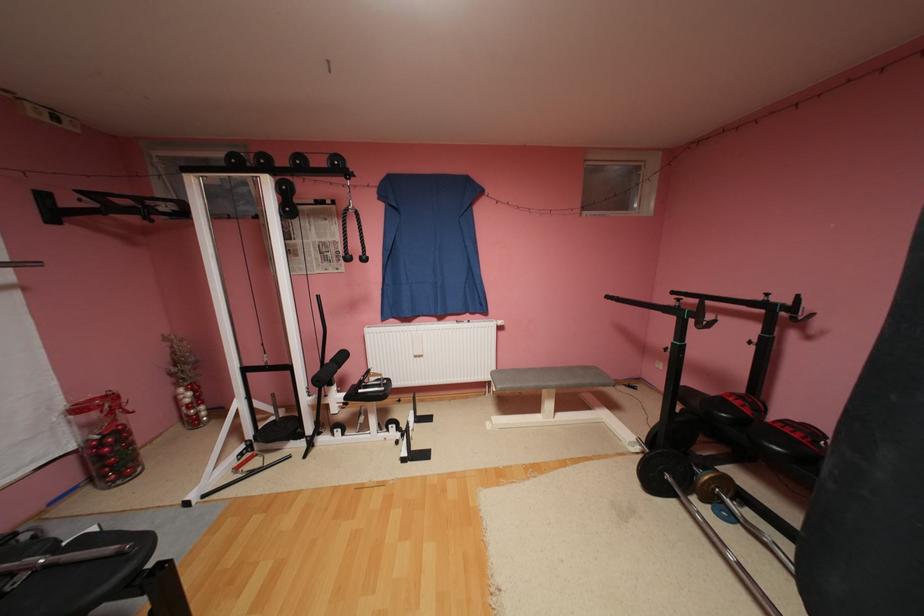
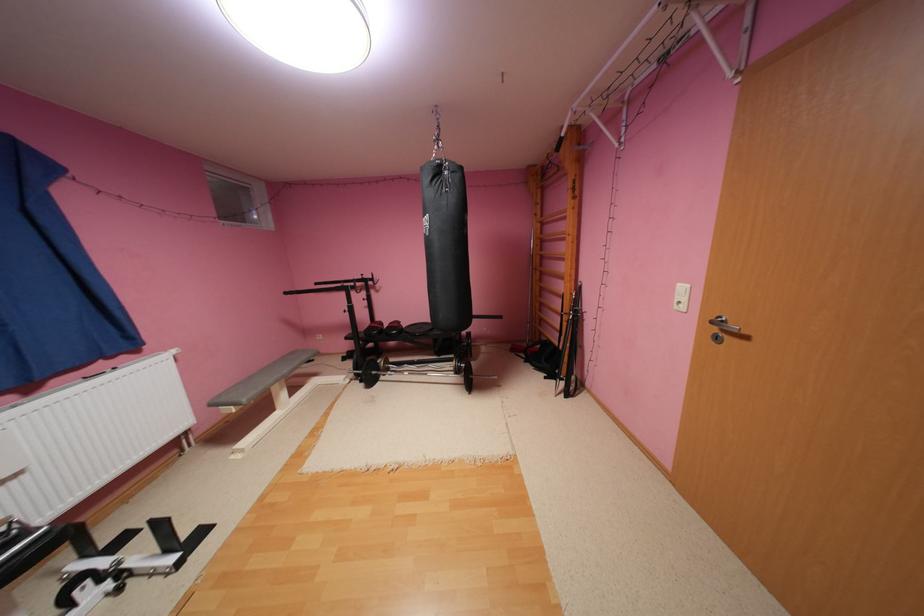
Locate, in the second image, the point that corresponds to pixel 616 297 in the first image.

(295, 293)